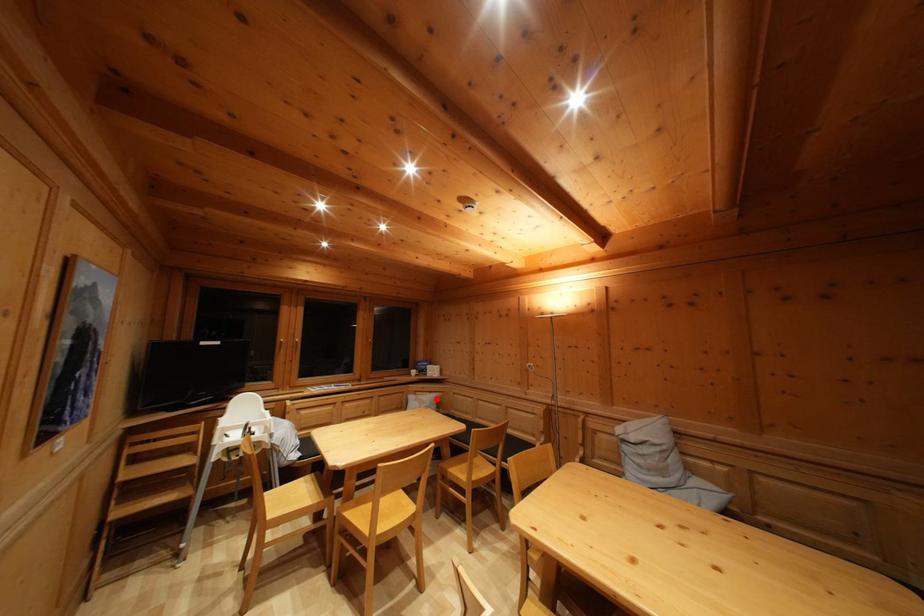
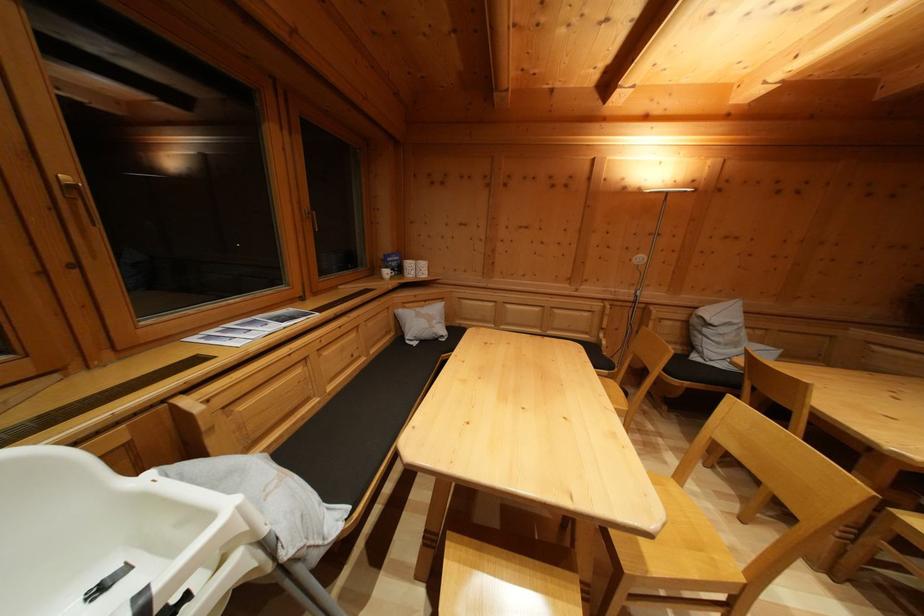
Question: I am providing you with two images of the same scene from different viewpoints. A red point is marked on the first image. Can you still see the location of the red point in image 2?

Choices:
 (A) Yes
 (B) No

Answer: (A)